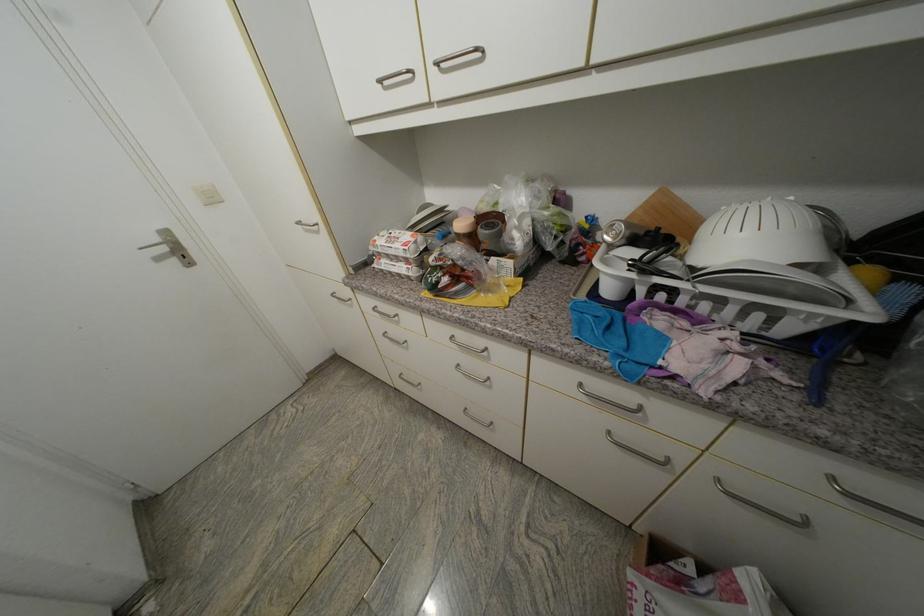
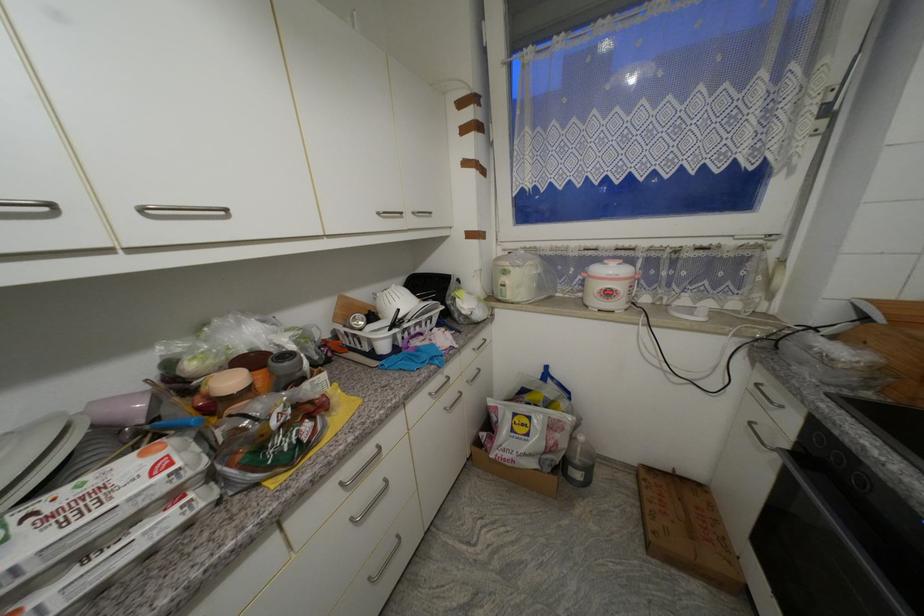
Question: The camera is either moving clockwise (left) or counter-clockwise (right) around the object. The first image is from the beginning of the video and the second image is from the end. Is the camera moving left or right when shooting the video?

Choices:
 (A) Left
 (B) Right

Answer: (A)